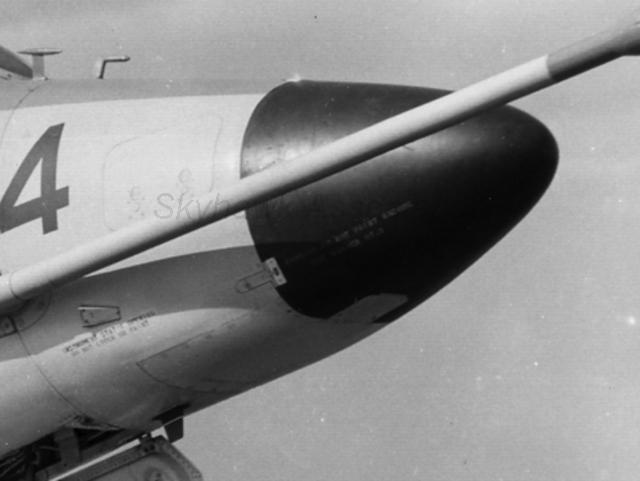
You are a GUI agent. You are given a task and a screenshot of the screen. Output one action in this format:
    pyautogui.click(x=<x>, y=<y>)
    Task: Click on the metal latch
    The height and width of the screenshot is (481, 640).
    Given the screenshot: What is the action you would take?
    point(271,274)